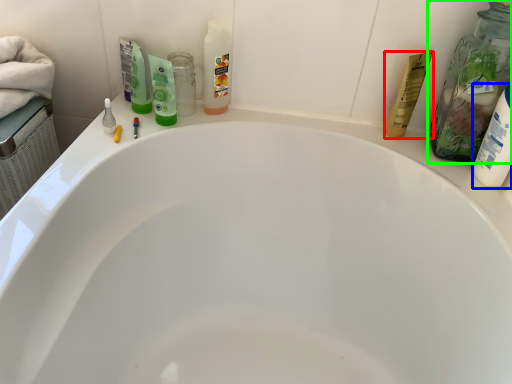
Question: Which is farther away from toiletry (highlighted by a red box)? toiletry (highlighted by a blue box) or cleaning product (highlighted by a green box)?

Choices:
 (A) toiletry
 (B) cleaning product

Answer: (A)